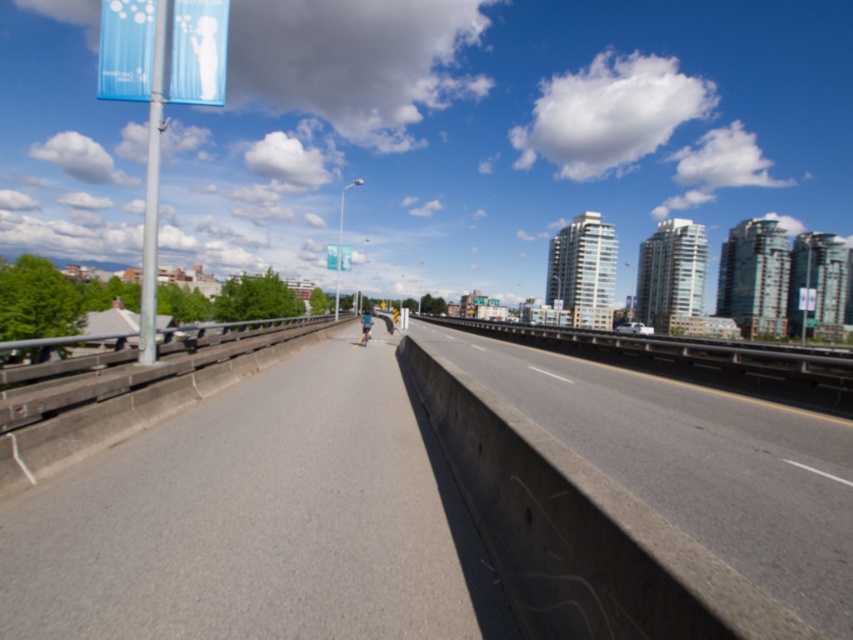
You are standing at the pedestrian pathway and want to reach both points. Which point, point [767,568] or point [346,262], is closer to you?

Point [767,568] is closer to the viewer than point [346,262].

You are a drone operator trying to land a drone on the concrete at center. The drone has a GPS system that requires coordinates to land. What are the coordinates where you should direct the drone to land?

The coordinates for the concrete at center are at point (695,461), so you should direct the drone to land there.

You are a delivery robot on the sidewalk and need to navigate around the white plastic traffic sign at center. Which direction should you move to avoid hitting the concrete at center?

The concrete at center is below the white plastic traffic sign at center, so you should move to the right or left to avoid hitting the concrete at center.